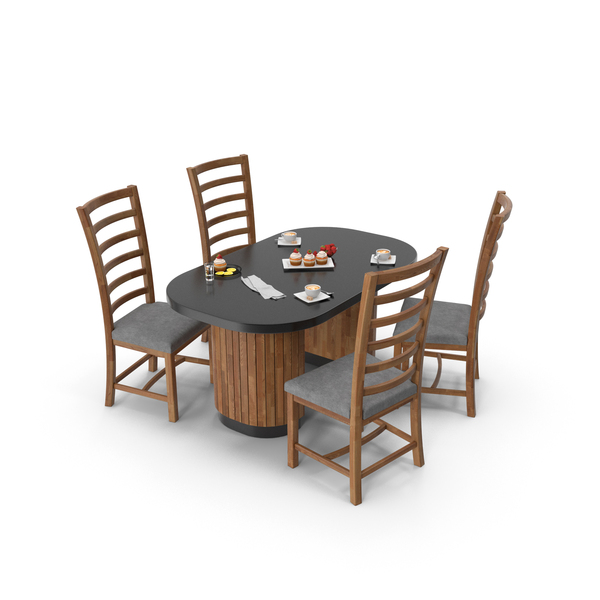
Locate an element on the screen. The width and height of the screenshot is (600, 600). mug is located at coordinates (385, 257).